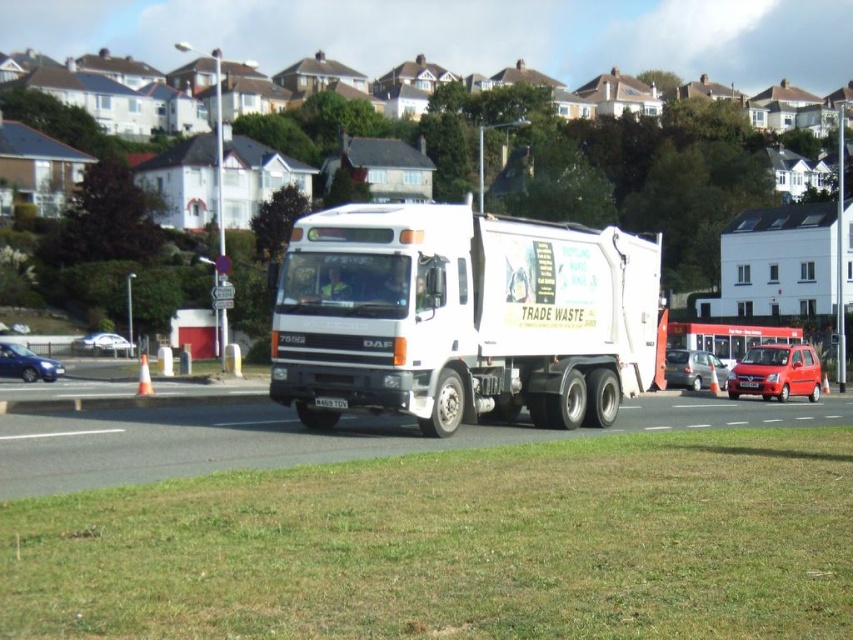
You are a pedestrian standing on the sidewalk and see the shiny silver sedan at left and the black plastic license plate at center. Which object is higher up in the image?

The shiny silver sedan at left is higher up in the image than the black plastic license plate at center.

You are a delivery driver who needs to park your van behind the shiny silver sedan at left and the black plastic license plate at center. Which one allows more vertical space for your van?

The shiny silver sedan at left is much taller than the black plastic license plate at center, so parking behind the black plastic license plate at center would provide more vertical space for your van.